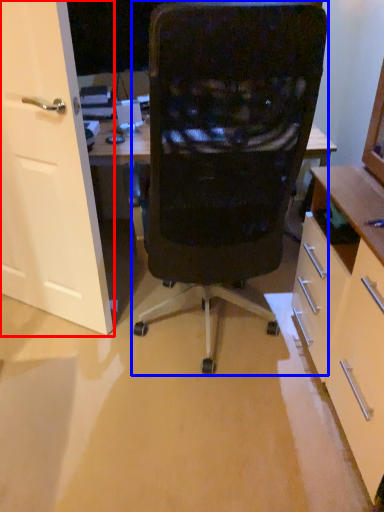
Question: Which object appears farthest to the camera in this image, door (highlighted by a red box) or chair (highlighted by a blue box)?

Choices:
 (A) door
 (B) chair

Answer: (A)